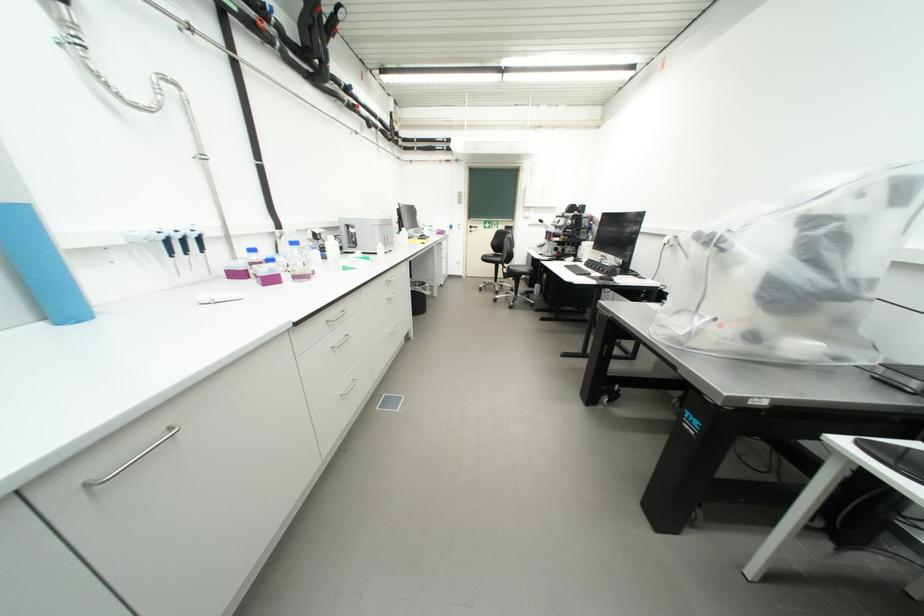
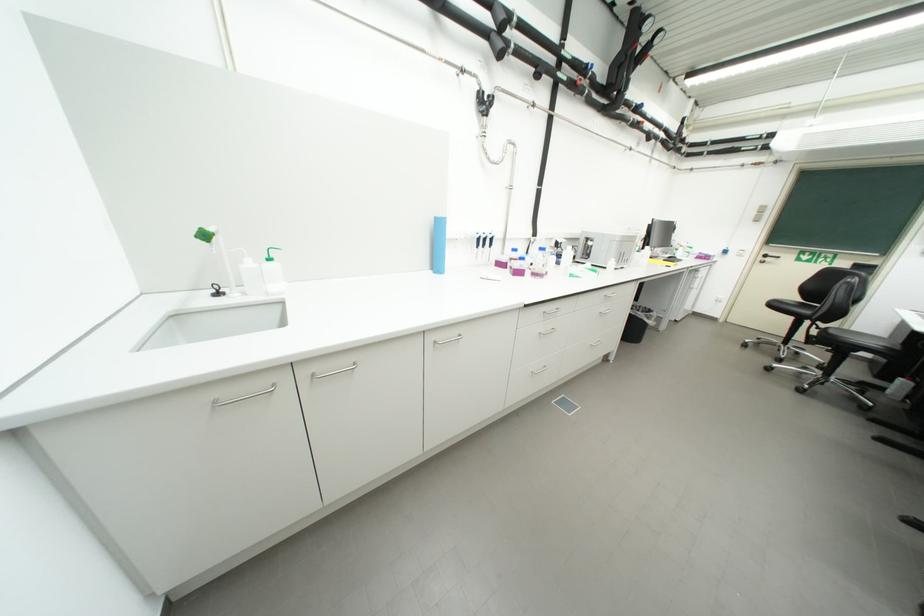
In the second image, find the point that corresponds to (x=493, y=261) in the first image.

(783, 307)